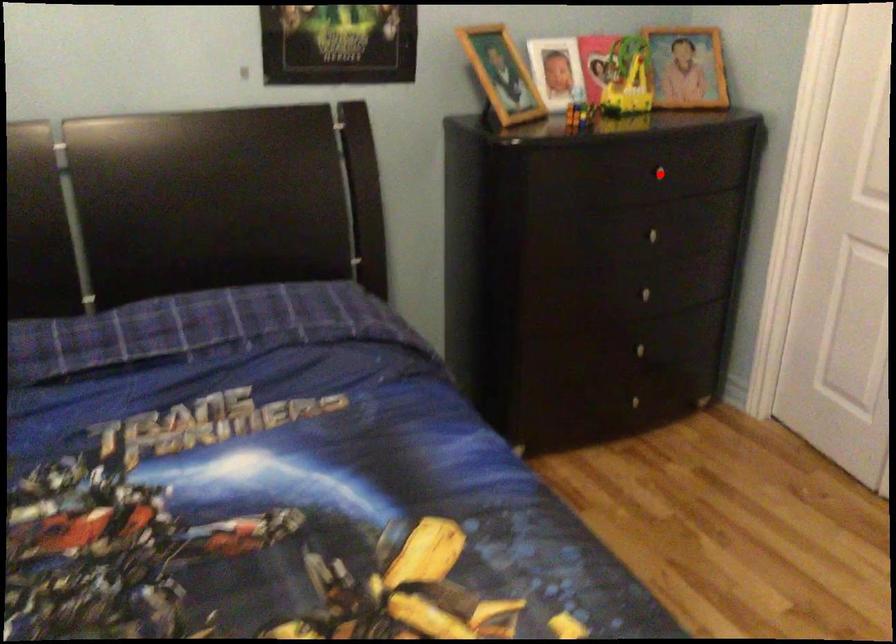
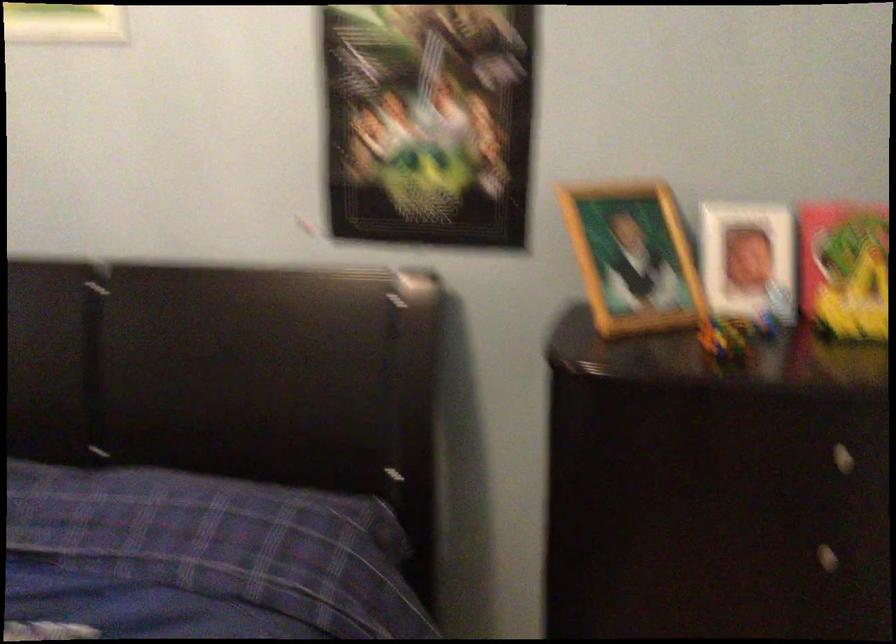
Where in the second image is the point corresponding to the highlighted location from the first image?

(840, 458)